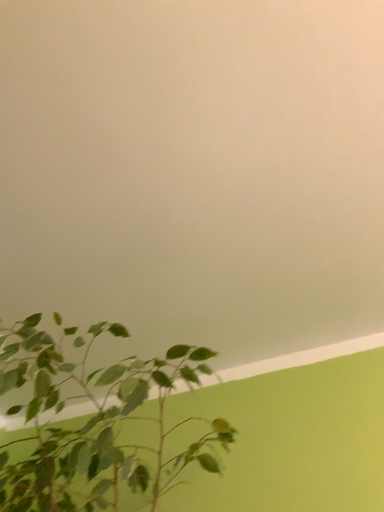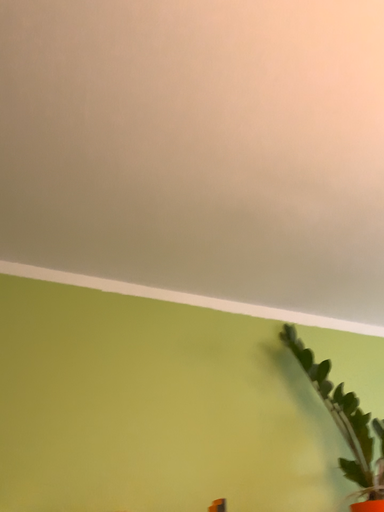
Question: How did the camera likely rotate when shooting the video?

Choices:
 (A) rotated right
 (B) rotated left

Answer: (A)